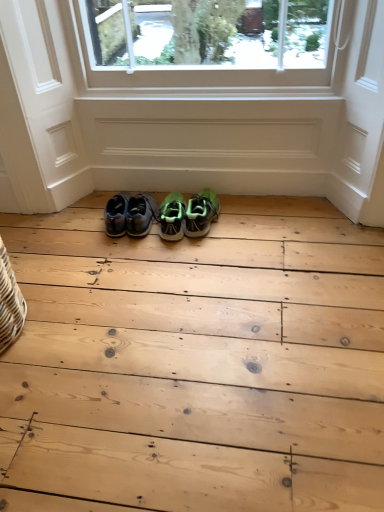
Question: Is point (147, 216) closer or farther from the camera than point (160, 228)?

Choices:
 (A) farther
 (B) closer

Answer: (B)

Question: Is matte black sneakers at center, acting as the 3th footwear starting from the right, in front of or behind green matte sneakers at center, which appears as the 2th footwear when viewed from the left, in the image?

Choices:
 (A) behind
 (B) front

Answer: (A)

Question: Which is nearer to the matte black sneakers at center, acting as the 3th footwear starting from the right?

Choices:
 (A) green matte sneakers at center, which appears as the 2th footwear when viewed from the left
 (B) green mesh sneakers at center, which ranks as the 1th footwear in right-to-left order

Answer: (A)

Question: Estimate the real-world distances between objects in this image. Which object is closer to the green matte sneakers at center, which is the second footwear in right-to-left order?

Choices:
 (A) matte black sneakers at center, acting as the 3th footwear starting from the right
 (B) green mesh sneakers at center, which is the third footwear in left-to-right order

Answer: (B)